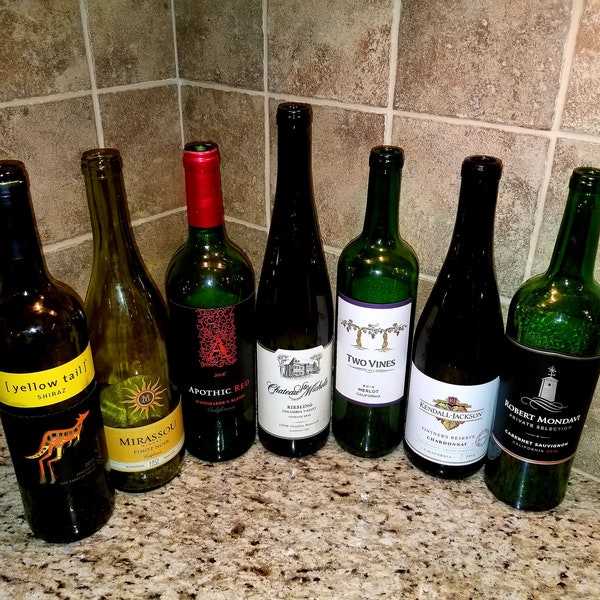
Find the location of a particular element. The width and height of the screenshot is (600, 600). glass bottle is located at coordinates (537, 310).